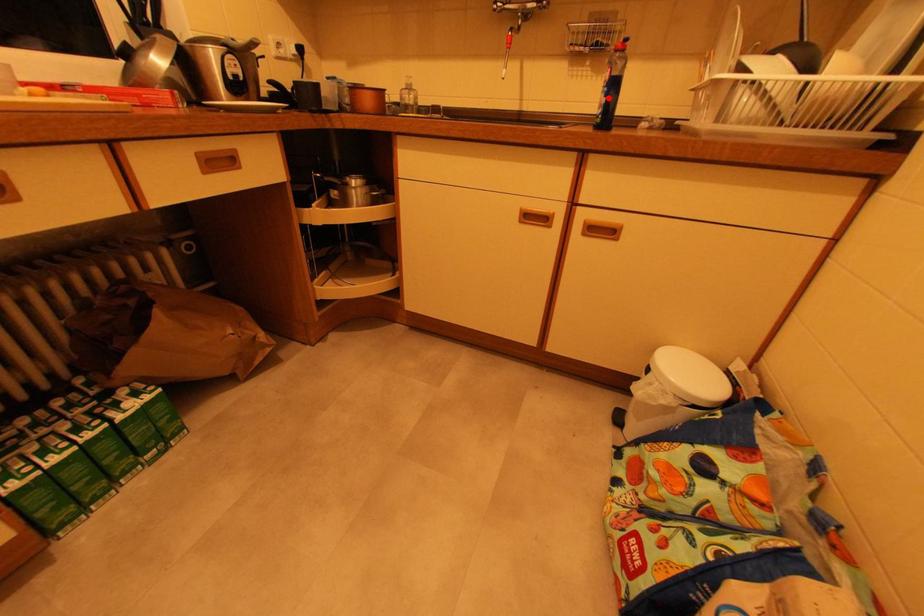
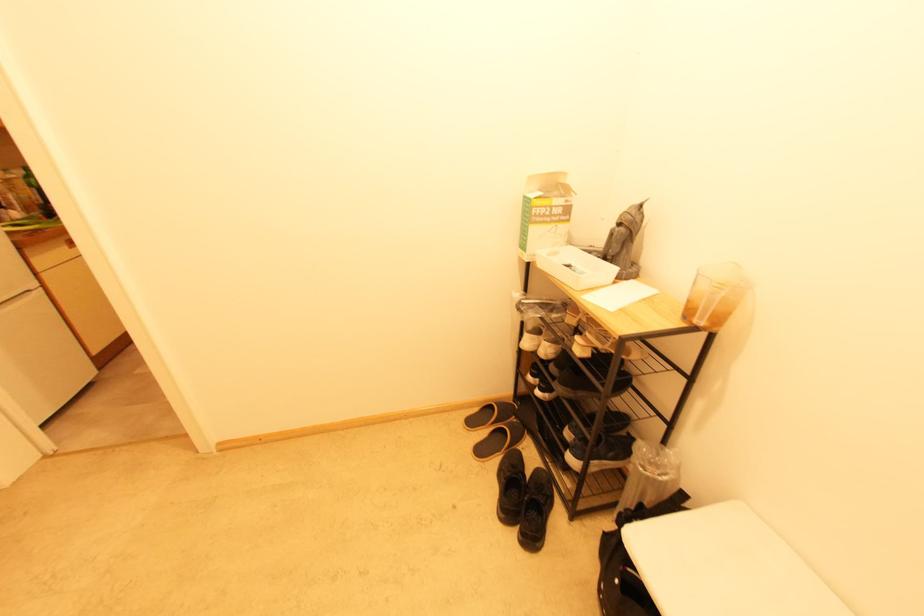
Question: I am providing you with two images of the same scene from different viewpoints. A red point is marked on the first image. At the location where the point appears in image 1, is it still visible in image 2?

Choices:
 (A) Yes
 (B) No

Answer: (B)